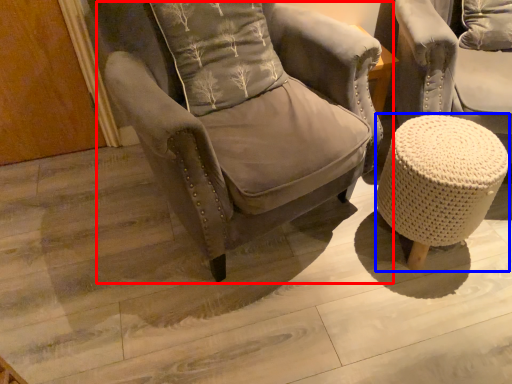
Question: Which of the following is the farthest to the observer, chair (highlighted by a red box) or bar stool (highlighted by a blue box)?

Choices:
 (A) chair
 (B) bar stool

Answer: (B)